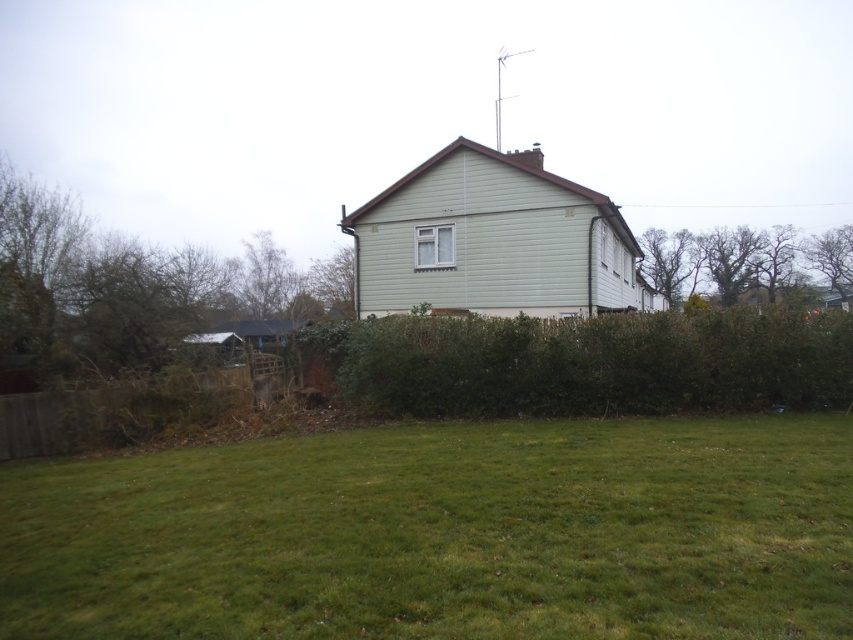
You are a gardener who wants to plant a new flower bed. You have two options for locations in the scene described. One is near the green grass at lower center, and the other is near the green leafy hedge at center. Which location would be better for planting flowers if you want the flowers to grow taller than the surrounding plants?

The green grass at lower center has a lesser height compared to the green leafy hedge at center. Therefore, planting flowers near the green grass at lower center would allow the flowers to grow taller than the surrounding plants.